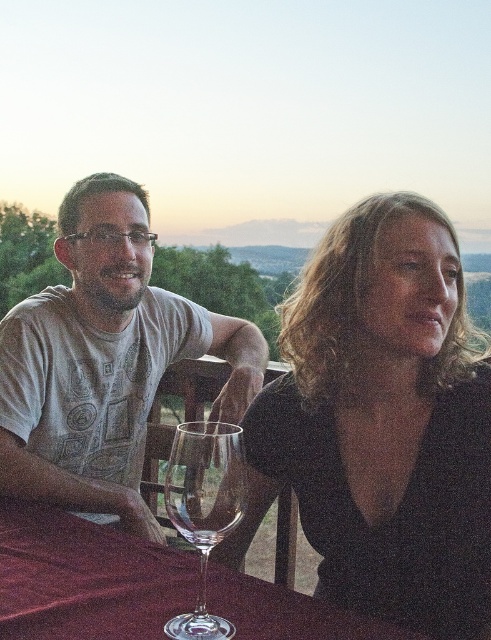
Question: Which object is farther from the camera taking this photo?

Choices:
 (A) transparent glass at center
 (B) matte gray t-shirt at left
 (C) black matte dress at center
 (D) transparent glass wine glass at center

Answer: (A)

Question: Can you confirm if smooth glass table at center is positioned below transparent glass wine glass at center?

Choices:
 (A) no
 (B) yes

Answer: (B)

Question: Which object appears farthest from the camera in this image?

Choices:
 (A) smooth glass table at center
 (B) matte gray t-shirt at left

Answer: (B)

Question: Does black matte dress at center appear on the right side of transparent glass at center?

Choices:
 (A) no
 (B) yes

Answer: (B)

Question: Which is farther from the black matte dress at center?

Choices:
 (A) matte gray t-shirt at left
 (B) transparent glass at center
 (C) transparent glass wine glass at center

Answer: (B)

Question: Is matte gray t-shirt at left wider than transparent glass at center?

Choices:
 (A) yes
 (B) no

Answer: (A)